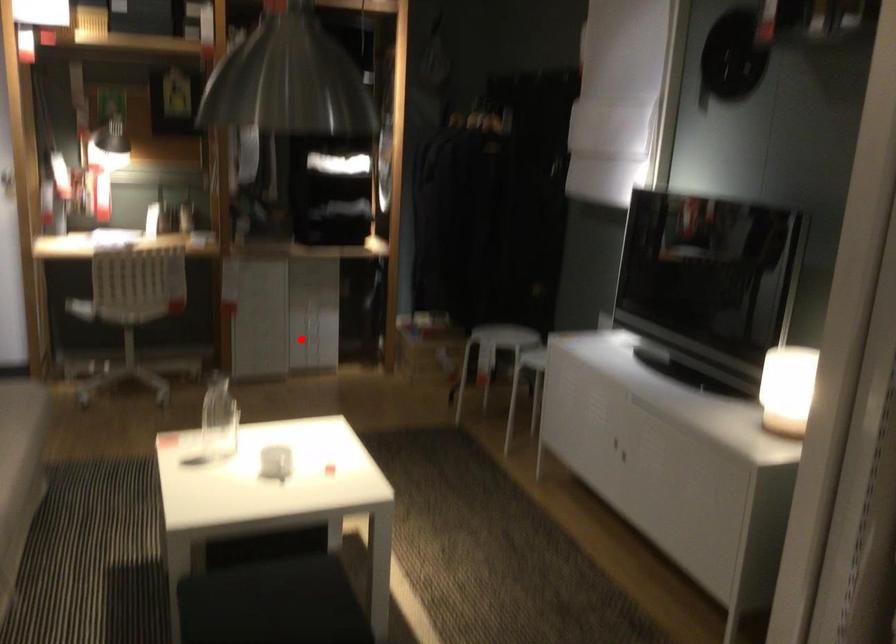
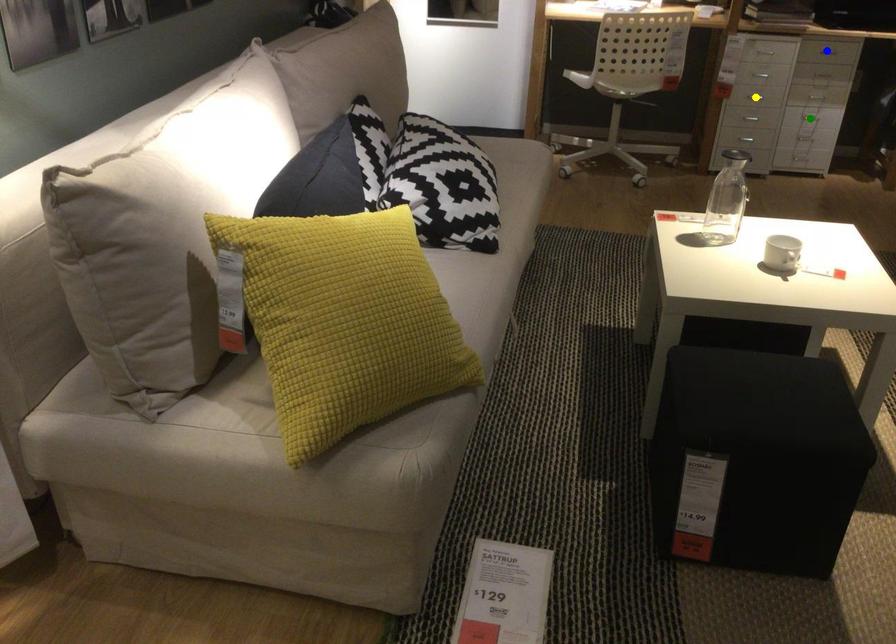
Question: I am providing you with two images of the same scene from different viewpoints. A red point is marked on the first image. You are given multiple points on the second image. Which spot in image 2 lines up with the point in image 1?

Choices:
 (A) yellow point
 (B) blue point
 (C) green point

Answer: (C)